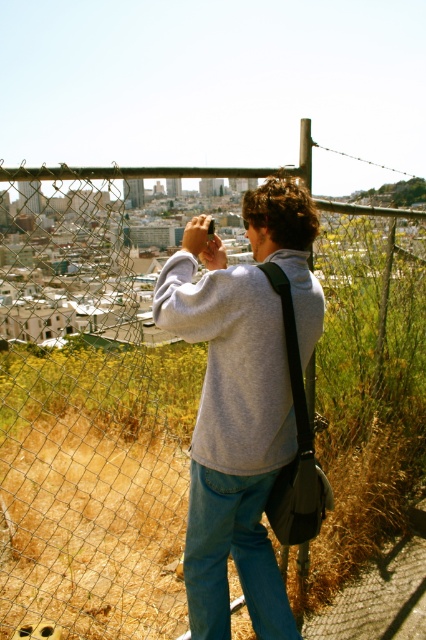
Is gray cotton sweatshirt at center positioned behind denim at left?

No, it is not.

The width and height of the screenshot is (426, 640). Describe the element at coordinates (230, 432) in the screenshot. I see `gray cotton sweatshirt at center` at that location.

Does point (195, 234) come in front of point (195, 515)?

That is False.

Find the location of a particular element. This screenshot has height=640, width=426. gray cotton sweatshirt at center is located at coordinates (230, 432).